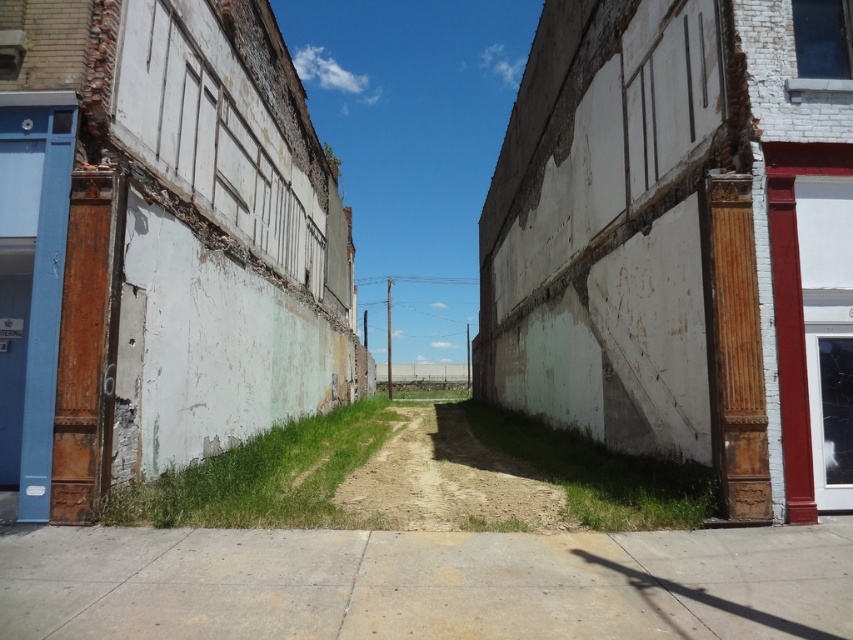
You are a delivery person trying to decide between taking the concrete sidewalk at center or the brown sandy dirt track at center to reach the end of the alley. Which path is closer to the left side of the alley?

The concrete sidewalk at center is positioned on the left side of brown sandy dirt track at center, so the concrete sidewalk at center is closer to the left side of the alley.

You are a delivery person with a cart that is 1.2 meters wide. You need to navigate through the alleyway shown in the image. Can your cart fit on the concrete sidewalk at center without crossing over to the brown sandy dirt track at center?

The concrete sidewalk at center is narrower than the brown sandy dirt track at center. Since the cart is 1.2 meters wide and the sidewalk is narrower, the cart cannot fit on the sidewalk without crossing over to the dirt track.